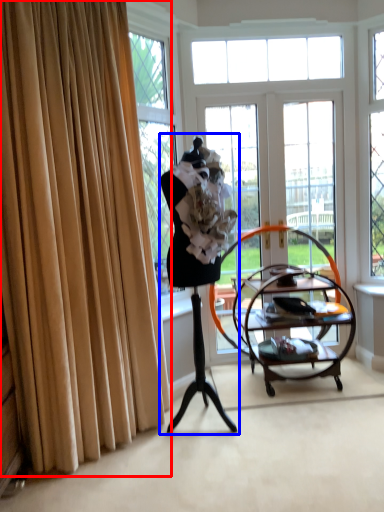
Question: Which object appears farthest to the camera in this image, curtain (highlighted by a red box) or woman (highlighted by a blue box)?

Choices:
 (A) curtain
 (B) woman

Answer: (B)